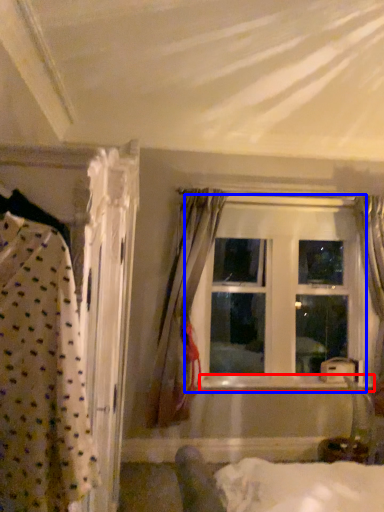
Question: Among these objects, which one is nearest to the camera, window sill (highlighted by a red box) or window (highlighted by a blue box)?

Choices:
 (A) window sill
 (B) window

Answer: (A)